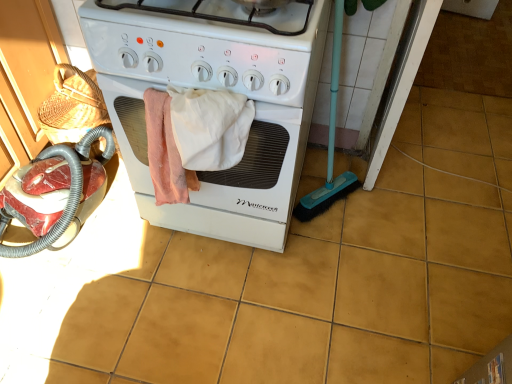
Where is `vacant space underneath yellow matte tile at center (from a real-world perspective)`? This screenshot has height=384, width=512. vacant space underneath yellow matte tile at center (from a real-world perspective) is located at coordinates point(476,184).